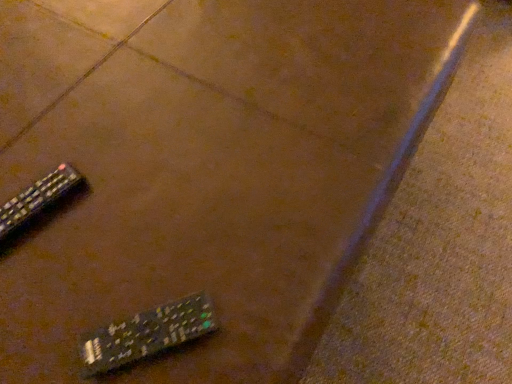
Question: In the image, is black plastic remote at lower left, which is the 1th remote control from back to front, on the left side or the right side of black plastic remote at lower left, which appears as the 2th remote control when viewed from the left?

Choices:
 (A) left
 (B) right

Answer: (A)

Question: Is black plastic remote at lower left, the 2th remote control viewed from the right, taller or shorter than black plastic remote at lower left, arranged as the 2th remote control when viewed from the back?

Choices:
 (A) short
 (B) tall

Answer: (A)

Question: From the image's perspective, is black plastic remote at lower left, which is the 1th remote control from back to front, located above or below black plastic remote at lower left, arranged as the first remote control when viewed from the right?

Choices:
 (A) above
 (B) below

Answer: (A)

Question: Considering the positions of black plastic remote at lower left, arranged as the first remote control when viewed from the right, and black plastic remote at lower left, which is the 1th remote control from back to front, in the image, is black plastic remote at lower left, arranged as the first remote control when viewed from the right, wider or thinner than black plastic remote at lower left, which is the 1th remote control from back to front,?

Choices:
 (A) thin
 (B) wide

Answer: (A)

Question: Is black plastic remote at lower left, arranged as the first remote control when viewed from the right, in front of or behind black plastic remote at lower left, which is the 1th remote control from back to front, in the image?

Choices:
 (A) behind
 (B) front

Answer: (B)

Question: From the image's perspective, is black plastic remote at lower left, the 2th remote control positioned from the top, located above or below black plastic remote at lower left, the 1th remote control positioned from the top?

Choices:
 (A) below
 (B) above

Answer: (A)

Question: From their relative heights in the image, would you say black plastic remote at lower left, arranged as the 2th remote control when viewed from the back, is taller or shorter than black plastic remote at lower left, the 2th remote control viewed from the right?

Choices:
 (A) short
 (B) tall

Answer: (B)